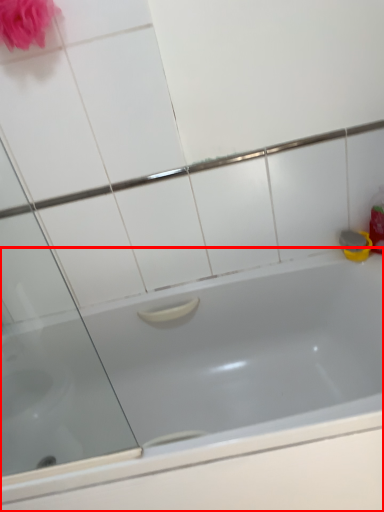
Question: From the image's perspective, considering the relative positions of bathtub (annotated by the red box) and rose in the image provided, where is bathtub (annotated by the red box) located with respect to the staircase?

Choices:
 (A) below
 (B) above

Answer: (A)